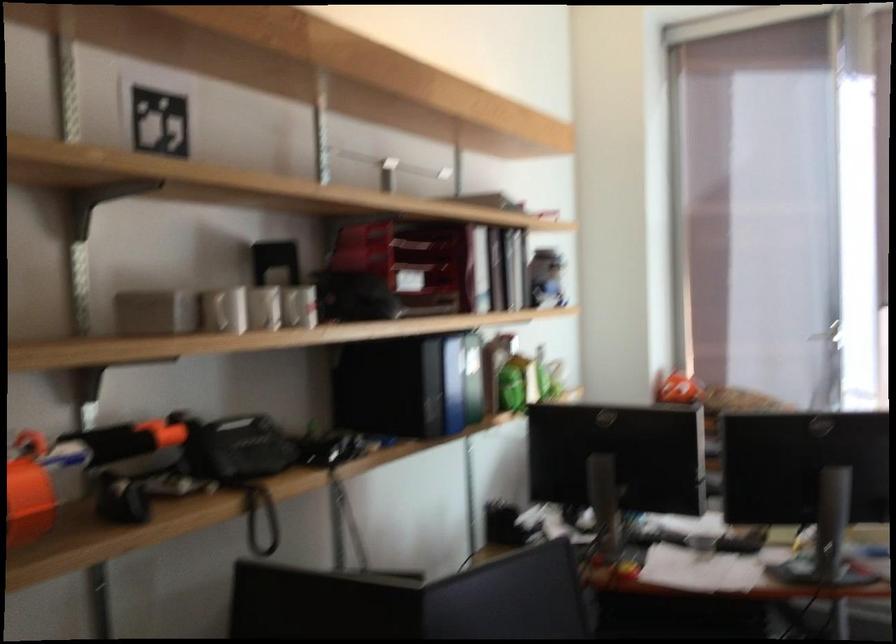
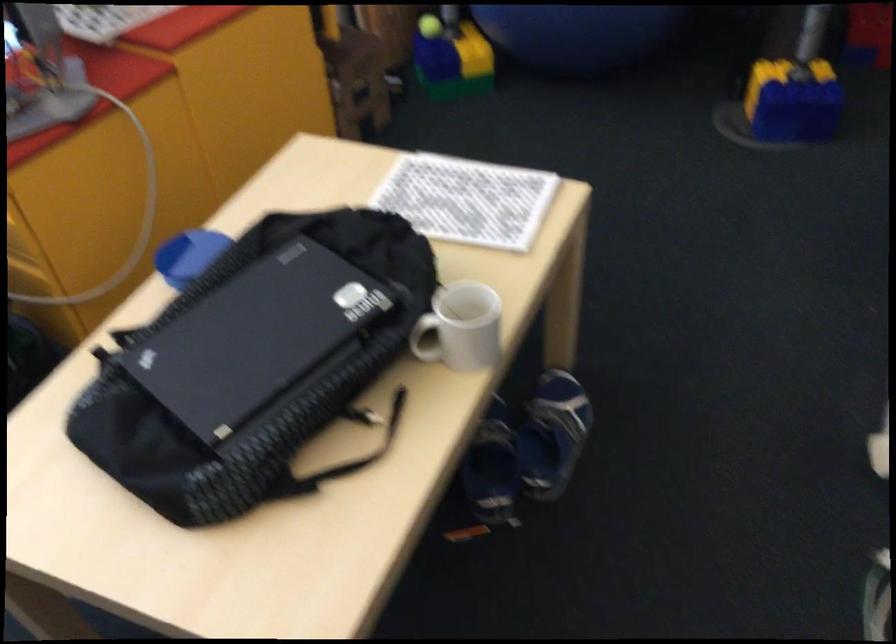
How did the camera likely rotate?

The rotation direction of the camera is right-down.